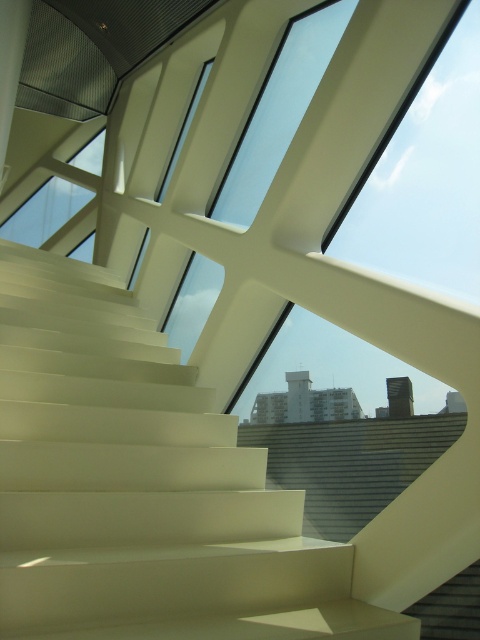
You are standing at the point with coordinates (142, 486) in the image. What object are you standing on?

You are standing on the white glossy stairs at center located at point (142, 486).

You are standing at the base of the staircase in the open space. You see two points marked on the floor, point 1 at coordinates point [141,484] and point 2 at coordinates point [34,246]. Which point is closer to you?

Point [34,246] is closer to you because it is behind point [141,484], which is in front of it.